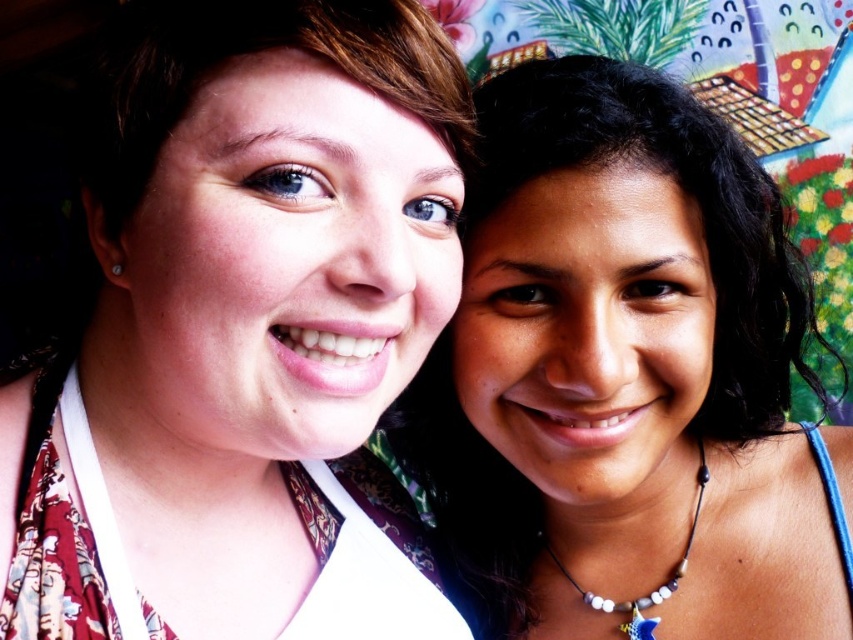
You are a photographer trying to focus on both the matte floral dress at center and the beige beaded necklace with star pendant at lower right. Since the dress is larger, which object should you adjust your camera focus on first to ensure both are in focus?

The matte floral dress at center is larger than the beige beaded necklace with star pendant at lower right. To ensure both are in focus, start by focusing on the matte floral dress at center since it requires more attention due to its size, then adjust slightly for the smaller necklace.

You are a photographer trying to focus on the subjects in the image. Since the matte floral dress at center and smooth skin face at center are both at the center, which one is narrower in width?

The matte floral dress at center is thinner than smooth skin face at center, so the matte floral dress at center is narrower in width.

You are standing in front of the photograph and want to touch the point at coordinates point (390, 225). If your hand is 12 inches away from the image, will your finger reach the point?

The point (390, 225) is 15.65 inches from the viewer. Since your hand is only 12 inches away, your finger will not reach the point as it is farther away than your hand position.